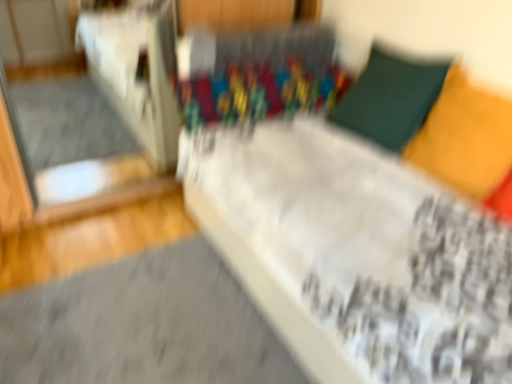
Measure the distance between velvet green pillow at upper right, marked as the 1th pillow in a back-to-front arrangement, and camera.

A distance of 1.63 meters exists between velvet green pillow at upper right, marked as the 1th pillow in a back-to-front arrangement, and camera.

This screenshot has height=384, width=512. What do you see at coordinates (390, 98) in the screenshot?
I see `velvet green pillow at upper right, marked as the 1th pillow in a back-to-front arrangement` at bounding box center [390, 98].

What do you see at coordinates (137, 71) in the screenshot? This screenshot has width=512, height=384. I see `transparent glass door at left` at bounding box center [137, 71].

Measure the distance between matte yellow pillow at upper right, arranged as the 1th pillow when viewed from the front, and camera.

The depth of matte yellow pillow at upper right, arranged as the 1th pillow when viewed from the front, is 4.50 feet.

The width and height of the screenshot is (512, 384). I want to click on velvet green pillow at upper right, the second pillow from the front, so click(x=390, y=98).

Identify the location of pillow positioned vertically above the velvet green pillow at upper right, the second pillow from the front (from a real-world perspective). This screenshot has width=512, height=384. (465, 137).

From the image's perspective, is velvet green pillow at upper right, marked as the 1th pillow in a back-to-front arrangement, above matte yellow pillow at upper right, arranged as the 1th pillow when viewed from the front?

Yes, from the image's perspective, velvet green pillow at upper right, marked as the 1th pillow in a back-to-front arrangement, is on top of matte yellow pillow at upper right, arranged as the 1th pillow when viewed from the front.

Who is more distant, velvet green pillow at upper right, the second pillow from the front, or matte yellow pillow at upper right, arranged as the 1th pillow when viewed from the front?

Positioned behind is velvet green pillow at upper right, the second pillow from the front.

Is point (384, 53) closer to viewer compared to point (474, 152)?

No, (384, 53) is behind (474, 152).

In the scene shown: From the image's perspective, is transparent glass door at left beneath velvet green pillow at upper right, the second pillow from the front?

Actually, transparent glass door at left appears above velvet green pillow at upper right, the second pillow from the front, in the image.

Is transparent glass door at left taller or shorter than velvet green pillow at upper right, the second pillow from the front?

transparent glass door at left is taller than velvet green pillow at upper right, the second pillow from the front.

Is transparent glass door at left next to velvet green pillow at upper right, the second pillow from the front, and touching it?

No, transparent glass door at left is not in contact with velvet green pillow at upper right, the second pillow from the front.

Which object is closer to the camera taking this photo, transparent glass door at left or velvet green pillow at upper right, the second pillow from the front?

velvet green pillow at upper right, the second pillow from the front.

From a real-world perspective, is velvet green pillow at upper right, the second pillow from the front, beneath transparent glass door at left?

Incorrect, from a real-world perspective, velvet green pillow at upper right, the second pillow from the front, is higher than transparent glass door at left.

You are a GUI agent. You are given a task and a screenshot of the screen. Output one action in this format:
    pyautogui.click(x=<x>, y=<y>)
    Task: Click on the glass door behind the velvet green pillow at upper right, marked as the 1th pillow in a back-to-front arrangement
    The width and height of the screenshot is (512, 384).
    Given the screenshot: What is the action you would take?
    pyautogui.click(x=137, y=71)

Which object is positioned more to the left, velvet green pillow at upper right, the second pillow from the front, or transparent glass door at left?

transparent glass door at left.

From the image's perspective, between velvet green pillow at upper right, marked as the 1th pillow in a back-to-front arrangement, and transparent glass door at left, which one is located above?

From the image's view, transparent glass door at left is above.

Looking at the image, does matte yellow pillow at upper right, arranged as the 1th pillow when viewed from the front, seem bigger or smaller compared to velvet green pillow at upper right, marked as the 1th pillow in a back-to-front arrangement?

Considering their sizes, matte yellow pillow at upper right, arranged as the 1th pillow when viewed from the front, takes up less space than velvet green pillow at upper right, marked as the 1th pillow in a back-to-front arrangement.

From the image's perspective, does matte yellow pillow at upper right, arranged as the 1th pillow when viewed from the front, appear higher than velvet green pillow at upper right, marked as the 1th pillow in a back-to-front arrangement?

Actually, matte yellow pillow at upper right, arranged as the 1th pillow when viewed from the front, appears below velvet green pillow at upper right, marked as the 1th pillow in a back-to-front arrangement, in the image.

Which is closer to the camera, (490, 112) or (416, 67)?

Point (490, 112) appears to be closer to the viewer than point (416, 67).

Is matte yellow pillow at upper right, arranged as the 1th pillow when viewed from the front, completely or partially outside of velvet green pillow at upper right, the second pillow from the front?

Yes, matte yellow pillow at upper right, arranged as the 1th pillow when viewed from the front, is outside of velvet green pillow at upper right, the second pillow from the front.

Is point (103, 58) closer or farther from the camera than point (449, 129)?

Point (103, 58) is positioned farther from the camera compared to point (449, 129).

Considering the sizes of objects transparent glass door at left and matte yellow pillow at upper right, which is the 2th pillow in back-to-front order, in the image provided, who is thinner, transparent glass door at left or matte yellow pillow at upper right, which is the 2th pillow in back-to-front order,?

matte yellow pillow at upper right, which is the 2th pillow in back-to-front order, is thinner.

You are a GUI agent. You are given a task and a screenshot of the screen. Output one action in this format:
    pyautogui.click(x=<x>, y=<y>)
    Task: Click on the glass door located underneath the matte yellow pillow at upper right, which is the 2th pillow in back-to-front order (from a real-world perspective)
    
    Given the screenshot: What is the action you would take?
    pyautogui.click(x=137, y=71)

In terms of size, does transparent glass door at left appear bigger or smaller than matte yellow pillow at upper right, arranged as the 1th pillow when viewed from the front?

Considering their sizes, transparent glass door at left takes up more space than matte yellow pillow at upper right, arranged as the 1th pillow when viewed from the front.

Would you say matte yellow pillow at upper right, which is the 2th pillow in back-to-front order, is outside transparent glass door at left?

Indeed, matte yellow pillow at upper right, which is the 2th pillow in back-to-front order, is completely outside transparent glass door at left.

Is matte yellow pillow at upper right, which is the 2th pillow in back-to-front order, far away from transparent glass door at left?

Yes.

Is matte yellow pillow at upper right, arranged as the 1th pillow when viewed from the front, positioned with its back to transparent glass door at left?

matte yellow pillow at upper right, arranged as the 1th pillow when viewed from the front, does not have its back to transparent glass door at left.

Does matte yellow pillow at upper right, arranged as the 1th pillow when viewed from the front, appear on the right side of transparent glass door at left?

Yes, matte yellow pillow at upper right, arranged as the 1th pillow when viewed from the front, is to the right of transparent glass door at left.

In order to click on pillow behind the matte yellow pillow at upper right, arranged as the 1th pillow when viewed from the front in this screenshot , I will do `click(390, 98)`.

Locate an element on the screen. the 1st pillow in front of the transparent glass door at left is located at coordinates (390, 98).

In the scene shown: When comparing their distances from transparent glass door at left, does velvet green pillow at upper right, the second pillow from the front, or matte yellow pillow at upper right, which is the 2th pillow in back-to-front order, seem further?

matte yellow pillow at upper right, which is the 2th pillow in back-to-front order, is further to transparent glass door at left.

Considering their positions, is transparent glass door at left positioned further to matte yellow pillow at upper right, arranged as the 1th pillow when viewed from the front, than velvet green pillow at upper right, the second pillow from the front?

transparent glass door at left.

Based on their spatial positions, is matte yellow pillow at upper right, arranged as the 1th pillow when viewed from the front, or transparent glass door at left further from velvet green pillow at upper right, marked as the 1th pillow in a back-to-front arrangement?

Based on the image, transparent glass door at left appears to be further to velvet green pillow at upper right, marked as the 1th pillow in a back-to-front arrangement.

Considering their positions, is matte yellow pillow at upper right, which is the 2th pillow in back-to-front order, positioned closer to transparent glass door at left than velvet green pillow at upper right, marked as the 1th pillow in a back-to-front arrangement?

The object closer to transparent glass door at left is velvet green pillow at upper right, marked as the 1th pillow in a back-to-front arrangement.

From the image, which object appears to be farther from velvet green pillow at upper right, the second pillow from the front, transparent glass door at left or matte yellow pillow at upper right, arranged as the 1th pillow when viewed from the front?

The object further to velvet green pillow at upper right, the second pillow from the front, is transparent glass door at left.

Estimate the real-world distances between objects in this image. Which object is further from matte yellow pillow at upper right, which is the 2th pillow in back-to-front order, velvet green pillow at upper right, marked as the 1th pillow in a back-to-front arrangement, or transparent glass door at left?

transparent glass door at left.

Find the location of `pillow between transparent glass door at left and matte yellow pillow at upper right, which is the 2th pillow in back-to-front order, from left to right`. pillow between transparent glass door at left and matte yellow pillow at upper right, which is the 2th pillow in back-to-front order, from left to right is located at coordinates (390, 98).